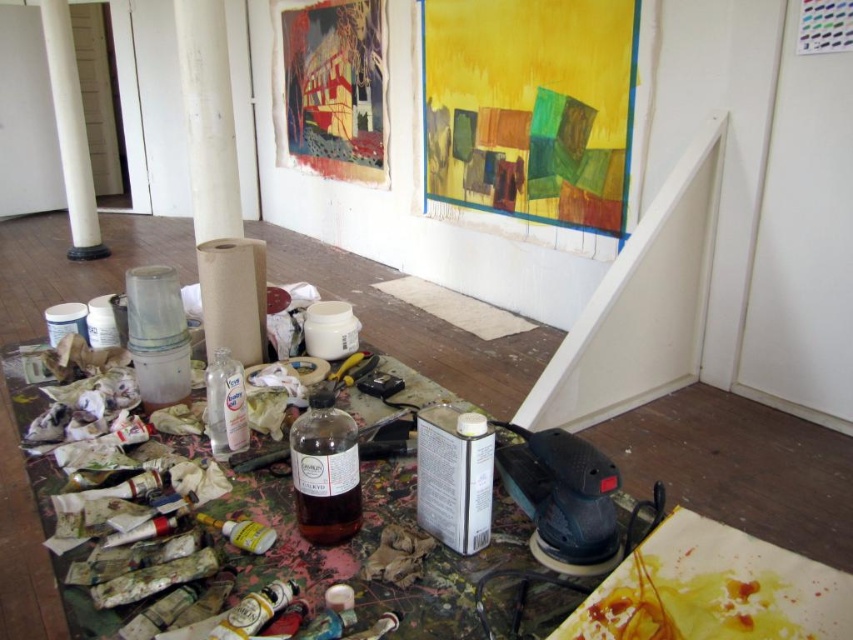
Who is shorter, matte gold paint tube at lower center or translucent plastic bottle at center?

translucent plastic bottle at center is shorter.

Is matte gold paint tube at lower center further to the viewer compared to translucent plastic bottle at center?

No, it is in front of translucent plastic bottle at center.

The width and height of the screenshot is (853, 640). What are the coordinates of `matte gold paint tube at lower center` in the screenshot? It's located at (254, 611).

Is point (229, 420) closer to viewer compared to point (231, 518)?

That is False.

Is clear plastic bottle at center to the left of translucent yellow bottle at center from the viewer's perspective?

Correct, you'll find clear plastic bottle at center to the left of translucent yellow bottle at center.

Describe the element at coordinates (225, 404) in the screenshot. I see `clear plastic bottle at center` at that location.

Image resolution: width=853 pixels, height=640 pixels. Find the location of `clear plastic bottle at center`. clear plastic bottle at center is located at coordinates (225, 404).

Can you confirm if translucent glass bottle at center is positioned to the left of clear plastic bottle at center?

In fact, translucent glass bottle at center is to the right of clear plastic bottle at center.

Between point (323, 538) and point (241, 376), which one is positioned behind?

The point (241, 376) is behind.

Where is `translucent glass bottle at center`? The height and width of the screenshot is (640, 853). translucent glass bottle at center is located at coordinates (325, 470).